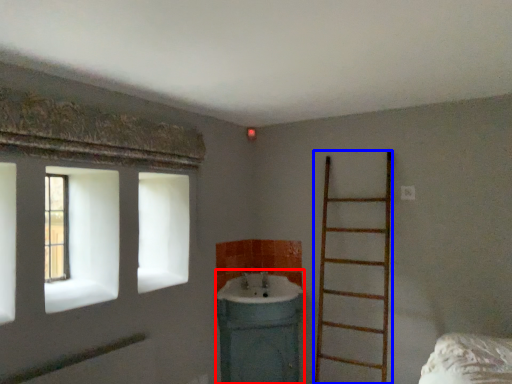
Question: Which object is closer to the camera taking this photo, sink (highlighted by a red box) or ladder (highlighted by a blue box)?

Choices:
 (A) sink
 (B) ladder

Answer: (B)